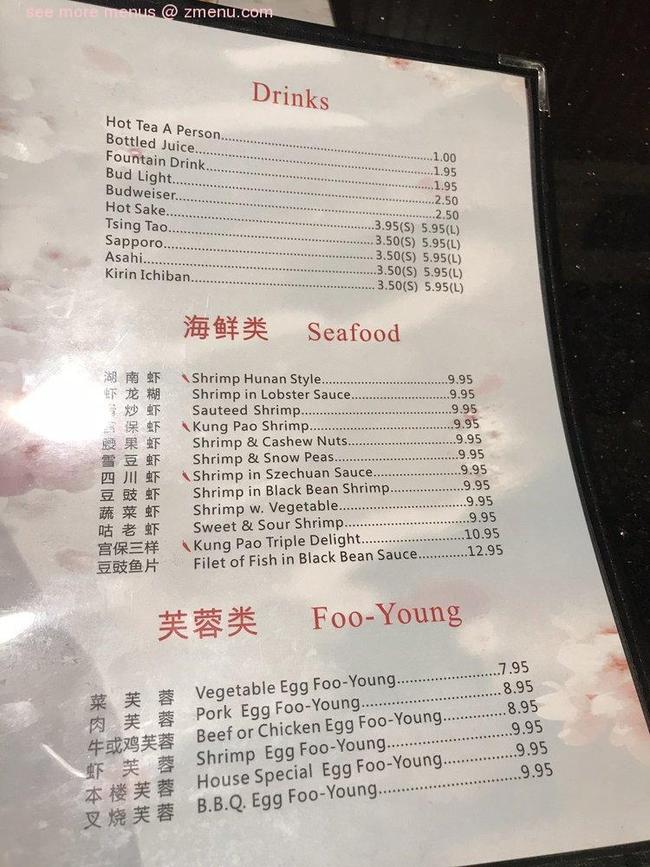
The image size is (650, 867). Find the location of `black table`. black table is located at coordinates (606, 168).